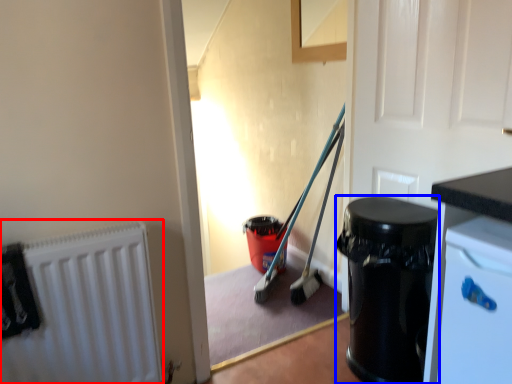
Question: Which of the following is the closest to the observer, radiator (highlighted by a red box) or garbage (highlighted by a blue box)?

Choices:
 (A) radiator
 (B) garbage

Answer: (A)